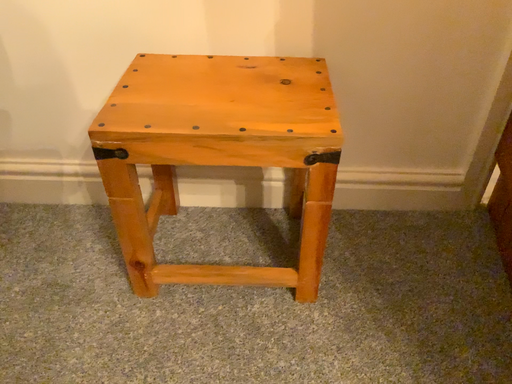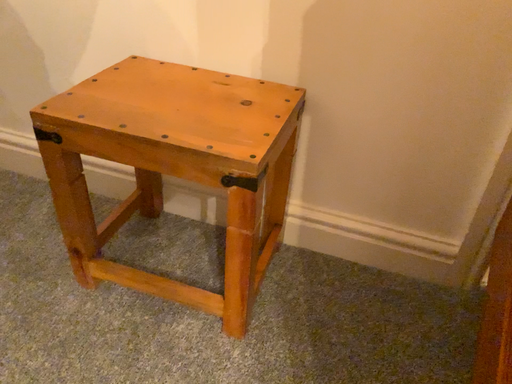
Question: Which way did the camera rotate in the video?

Choices:
 (A) rotated left
 (B) rotated right

Answer: (A)